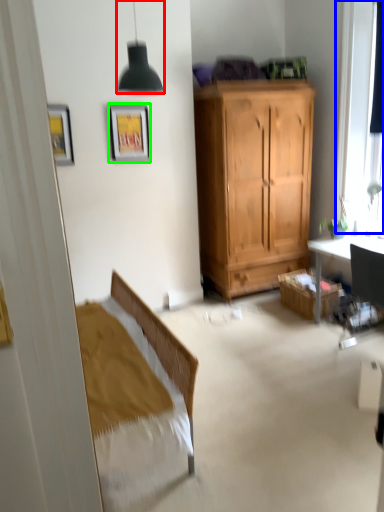
Question: Which object is the farthest from lamp (highlighted by a red box)? Choose among these: window (highlighted by a blue box) or picture frame (highlighted by a green box).

Choices:
 (A) window
 (B) picture frame

Answer: (A)